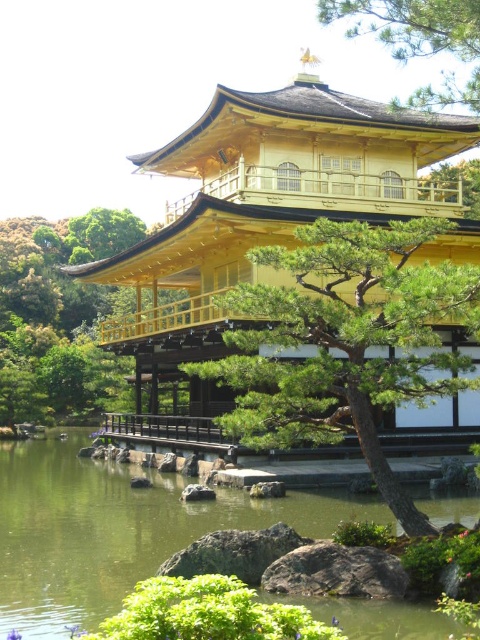
You are a visitor at the Golden Pavilion and want to take a photo that includes both the green textured tree at upper center and the green matte tree at upper right. Which tree should you position closer to the edge of your camera frame to ensure both fit in the shot?

Since the green textured tree at upper center is narrower than the green matte tree at upper right, you should position the green textured tree at upper center closer to the edge of your camera frame to ensure both fit in the shot.

You are a visitor at the Golden Pavilion and want to take a photo that includes both the green textured tree at center and the green matte tree at upper right. Which tree should you focus on first to ensure both are in the frame?

The green textured tree at center is shorter than the green matte tree at upper right, so you should focus on the green matte tree at upper right first to ensure both are in the frame.

You are a photographer standing at the edge of the pond near the Golden Pavilion. You want to take a photo of the green textured tree at center and the green liquid water at center. How far apart are these two elements in the scene?

The green textured tree at center is 8.75 meters away from the green liquid water at center.